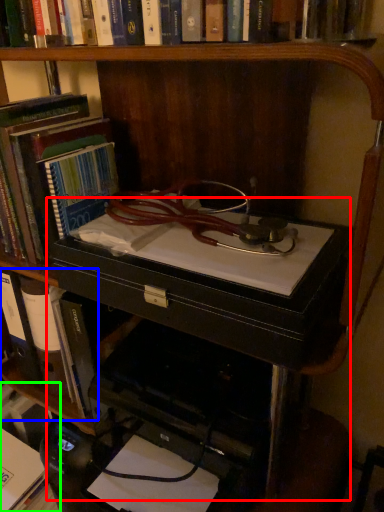
Question: Which object is the farthest from computer desk (highlighted by a red box)? Choose among these: book (highlighted by a blue box) or book (highlighted by a green box).

Choices:
 (A) book
 (B) book

Answer: (B)